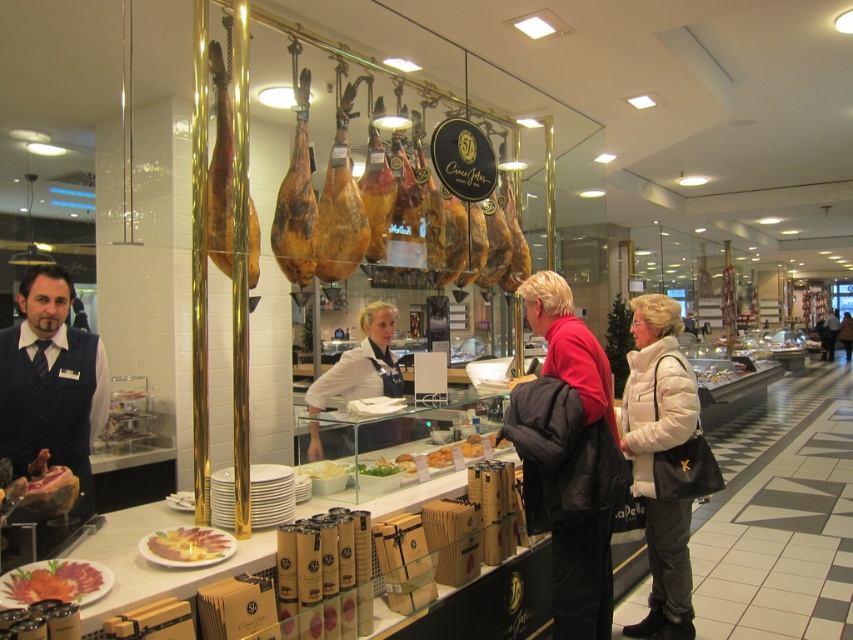
Question: Which point is farther to the camera?

Choices:
 (A) (363, 464)
 (B) (171, 536)

Answer: (A)

Question: Can you confirm if gold polished ham at center is wider than smooth yellow cheese at center?

Choices:
 (A) yes
 (B) no

Answer: (B)

Question: From the image, what is the correct spatial relationship of matte black jacket at center in relation to green leafy salad at center?

Choices:
 (A) above
 (B) below

Answer: (A)

Question: Estimate the real-world distances between objects in this image. Which object is farther from the gold polished ham at center?

Choices:
 (A) green leafy salad at center
 (B) smooth yellow cheese at center
 (C) white matte jacket at center

Answer: (C)

Question: Which is farther from the smooth yellow cheese at center?

Choices:
 (A) green leafy salad at center
 (B) white paper plate at center

Answer: (A)

Question: Does smooth yellow cheese at center have a greater width compared to white paper plate at center?

Choices:
 (A) no
 (B) yes

Answer: (B)